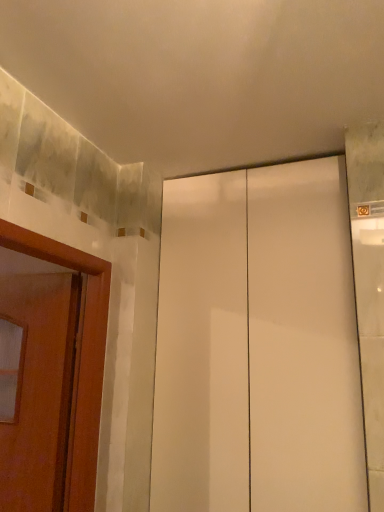
Question: Should I look upward or downward to see white glossy cabinet at center?

Choices:
 (A) up
 (B) down

Answer: (B)